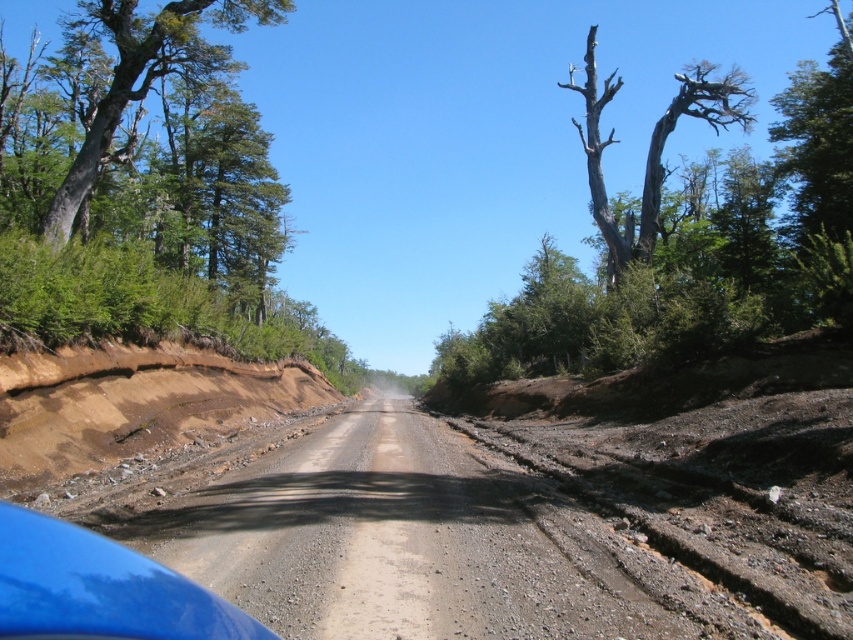
Does green leafy tree at left appear on the right side of blue glossy car at lower left?

In fact, green leafy tree at left is to the left of blue glossy car at lower left.

Between point (186, 4) and point (125, 561), which one is positioned behind?

Positioned behind is point (186, 4).

Where is `green leafy tree at left`? This screenshot has width=853, height=640. green leafy tree at left is located at coordinates (103, 108).

Is point (190, 609) closer to viewer compared to point (732, 122)?

Yes, point (190, 609) is in front of point (732, 122).

Is point (16, 534) farther from viewer compared to point (595, 221)?

No.

At what (x,y) coordinates should I click in order to perform the action: click on blue glossy car at lower left. Please return your answer as a coordinate pair (x, y). This screenshot has width=853, height=640. Looking at the image, I should click on (100, 588).

Measure the distance between green leafy tree at left and camera.

green leafy tree at left is 18.02 meters from camera.

Is green leafy tree at left positioned behind bare wood tree at upper right?

No, green leafy tree at left is closer to the viewer.

Between point (18, 216) and point (589, 36), which one is positioned in front?

Point (18, 216) is in front.

Locate an element on the screen. This screenshot has width=853, height=640. green leafy tree at left is located at coordinates coord(103,108).